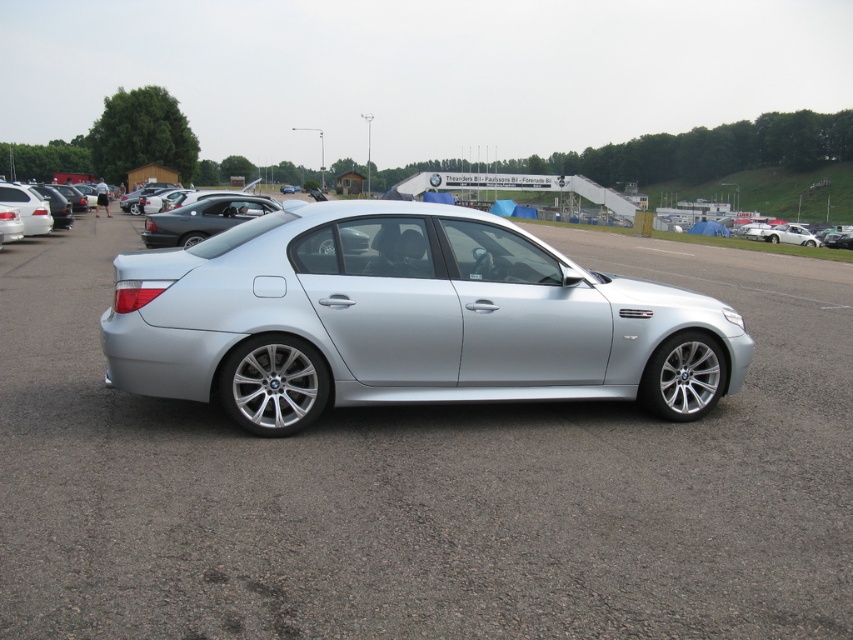
Question: Which point is farther to the camera?

Choices:
 (A) (38, 204)
 (B) (138, 360)
 (C) (816, 509)

Answer: (A)

Question: Estimate the real-world distances between objects in this image. Which object is farther from the silver metallic car at center?

Choices:
 (A) silver metallic sedan at left
 (B) satin silver car at center

Answer: (A)

Question: Is silver metallic car at center positioned before satin silver car at center?

Choices:
 (A) no
 (B) yes

Answer: (B)

Question: Where is satin silver car at center located in relation to silver metallic sedan at left in the image?

Choices:
 (A) below
 (B) above

Answer: (A)

Question: Is silver metallic car at center above satin silver car at center?

Choices:
 (A) yes
 (B) no

Answer: (A)

Question: Based on their relative distances, which object is farther from the silver metallic car at center?

Choices:
 (A) satin silver car at center
 (B) silver metallic sedan at left

Answer: (B)